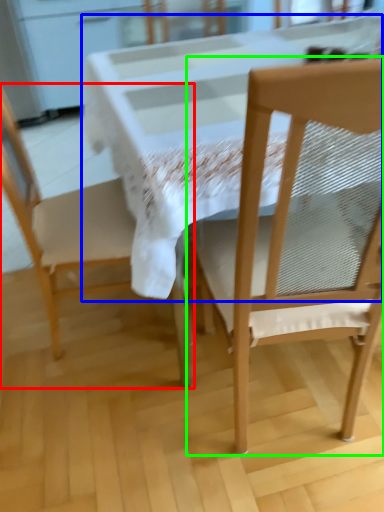
Question: Which is farther away from chair (highlighted by a red box)? round table (highlighted by a blue box) or chair (highlighted by a green box)?

Choices:
 (A) round table
 (B) chair

Answer: (B)